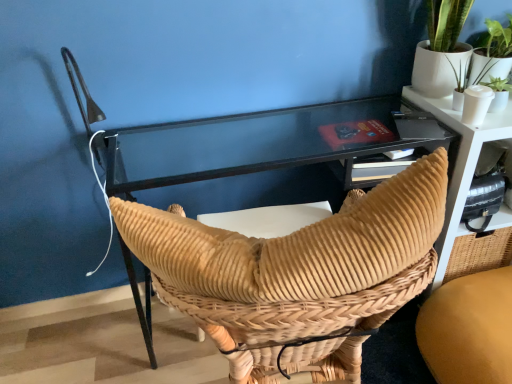
Question: Could you tell me if brown woven chair at center, marked as the first chair in a right-to-left arrangement, is turned towards matte black table at upper right?

Choices:
 (A) no
 (B) yes

Answer: (A)

Question: Is brown woven chair at center, the second chair in the left-to-right sequence, positioned beyond the bounds of matte black table at upper right?

Choices:
 (A) yes
 (B) no

Answer: (A)

Question: Does brown woven chair at center, marked as the first chair in a right-to-left arrangement, have a smaller size compared to matte black table at upper right?

Choices:
 (A) yes
 (B) no

Answer: (A)

Question: Does brown woven chair at center, marked as the first chair in a right-to-left arrangement, have a larger size compared to matte black table at upper right?

Choices:
 (A) no
 (B) yes

Answer: (A)

Question: Is brown woven chair at center, marked as the first chair in a right-to-left arrangement, not near matte black table at upper right?

Choices:
 (A) yes
 (B) no

Answer: (B)

Question: From a real-world perspective, is brown woven chair at center, the second chair in the left-to-right sequence, positioned above or below matte black table at upper right?

Choices:
 (A) below
 (B) above

Answer: (A)

Question: Looking at the image, does brown woven chair at center, the second chair in the left-to-right sequence, seem bigger or smaller compared to matte black table at upper right?

Choices:
 (A) big
 (B) small

Answer: (B)

Question: Is brown woven chair at center, the second chair in the left-to-right sequence, taller or shorter than matte black table at upper right?

Choices:
 (A) short
 (B) tall

Answer: (A)

Question: Is brown woven chair at center, marked as the first chair in a right-to-left arrangement, wider or thinner than matte black table at upper right?

Choices:
 (A) wide
 (B) thin

Answer: (A)

Question: From a real-world perspective, is woven tan chair at center, which is the 2th chair in right-to-left order, positioned above or below brown woven chair at center, marked as the first chair in a right-to-left arrangement?

Choices:
 (A) below
 (B) above

Answer: (B)

Question: In terms of height, does woven tan chair at center, marked as the 1th chair in a left-to-right arrangement, look taller or shorter compared to brown woven chair at center, the second chair in the left-to-right sequence?

Choices:
 (A) short
 (B) tall

Answer: (B)

Question: Is woven tan chair at center, marked as the 1th chair in a left-to-right arrangement, situated inside brown woven chair at center, marked as the first chair in a right-to-left arrangement, or outside?

Choices:
 (A) outside
 (B) inside

Answer: (A)

Question: In the image, is woven tan chair at center, marked as the 1th chair in a left-to-right arrangement, on the left side or the right side of brown woven chair at center, marked as the first chair in a right-to-left arrangement?

Choices:
 (A) right
 (B) left

Answer: (B)

Question: In terms of width, does matte black table at upper right look wider or thinner when compared to woven tan chair at center, marked as the 1th chair in a left-to-right arrangement?

Choices:
 (A) thin
 (B) wide

Answer: (A)

Question: Is matte black table at upper right taller or shorter than woven tan chair at center, which is the 2th chair in right-to-left order?

Choices:
 (A) tall
 (B) short

Answer: (B)